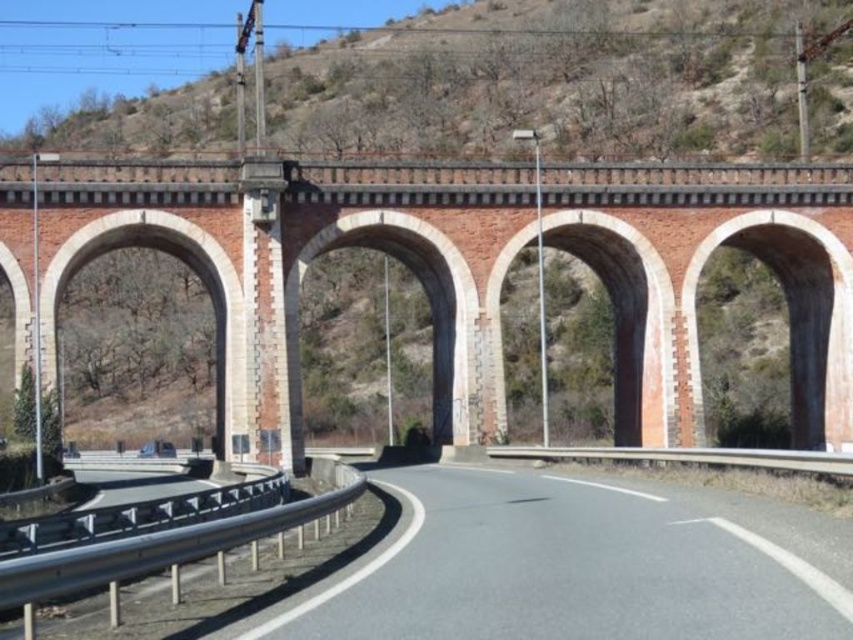
Is gray asphalt road at center shorter than metallic gray train track at lower left?

Yes, gray asphalt road at center is shorter than metallic gray train track at lower left.

Locate an element on the screen. The width and height of the screenshot is (853, 640). gray asphalt road at center is located at coordinates (572, 566).

Who is more distant from viewer, (280, 621) or (142, 572)?

Positioned behind is point (280, 621).

The height and width of the screenshot is (640, 853). I want to click on gray asphalt road at center, so click(x=572, y=566).

Is red brick bridge at center wider than gray asphalt road at center?

Indeed, red brick bridge at center has a greater width compared to gray asphalt road at center.

Can you confirm if red brick bridge at center is shorter than gray asphalt road at center?

No.

Is point (743, 240) positioned in front of point (373, 481)?

No, it is behind (373, 481).

Where is `red brick bridge at center`? This screenshot has width=853, height=640. red brick bridge at center is located at coordinates (451, 273).

Who is lower down, red brick bridge at center or metallic gray train track at lower left?

Positioned lower is metallic gray train track at lower left.

You are a GUI agent. You are given a task and a screenshot of the screen. Output one action in this format:
    pyautogui.click(x=<x>, y=<y>)
    Task: Click on the red brick bridge at center
    Image resolution: width=853 pixels, height=640 pixels.
    Given the screenshot: What is the action you would take?
    pyautogui.click(x=451, y=273)

The image size is (853, 640). I want to click on red brick bridge at center, so click(451, 273).